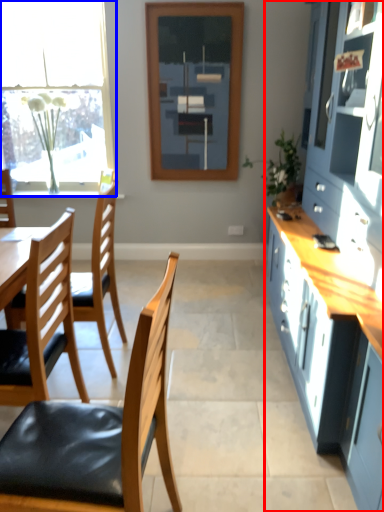
Question: Which point is further to the camera, cabinetry (highlighted by a red box) or window (highlighted by a blue box)?

Choices:
 (A) cabinetry
 (B) window

Answer: (B)